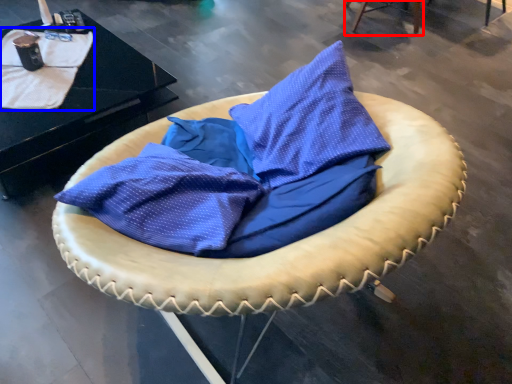
Question: Which object appears closest to the camera in this image, furniture (highlighted by a red box) or blanket (highlighted by a blue box)?

Choices:
 (A) furniture
 (B) blanket

Answer: (B)